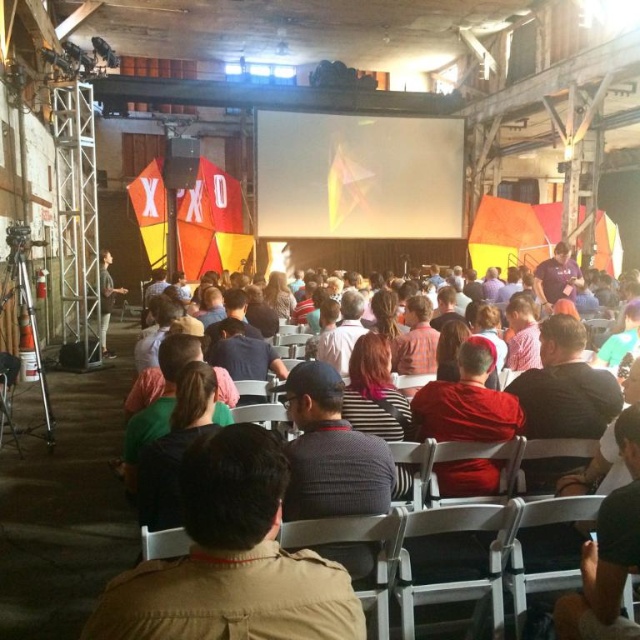
Question: Does multicolored fabric crowd at center appear on the right side of dark gray shirt at left?

Choices:
 (A) yes
 (B) no

Answer: (A)

Question: Which of these objects is positioned farthest from the red matte shirt at center?

Choices:
 (A) green matte shirt at center
 (B) light brown hair at center
 (C) matte black speaker at upper center

Answer: (C)

Question: Based on their relative distances, which object is nearer to the matte black speaker at upper center?

Choices:
 (A) white glossy screen at center
 (B) brown fabric jacket at center
 (C) light brown hair at center
 (D) striped shirt at center

Answer: (A)

Question: Does multicolored fabric crowd at center appear under plaid shirt at center?

Choices:
 (A) yes
 (B) no

Answer: (A)

Question: From the image, what is the correct spatial relationship of red matte shirt at center in relation to striped shirt at center?

Choices:
 (A) above
 (B) below

Answer: (B)

Question: Which point is farther to the camera?

Choices:
 (A) (176, 486)
 (B) (547, 355)
 (C) (552, 289)
 (D) (264, 483)

Answer: (C)